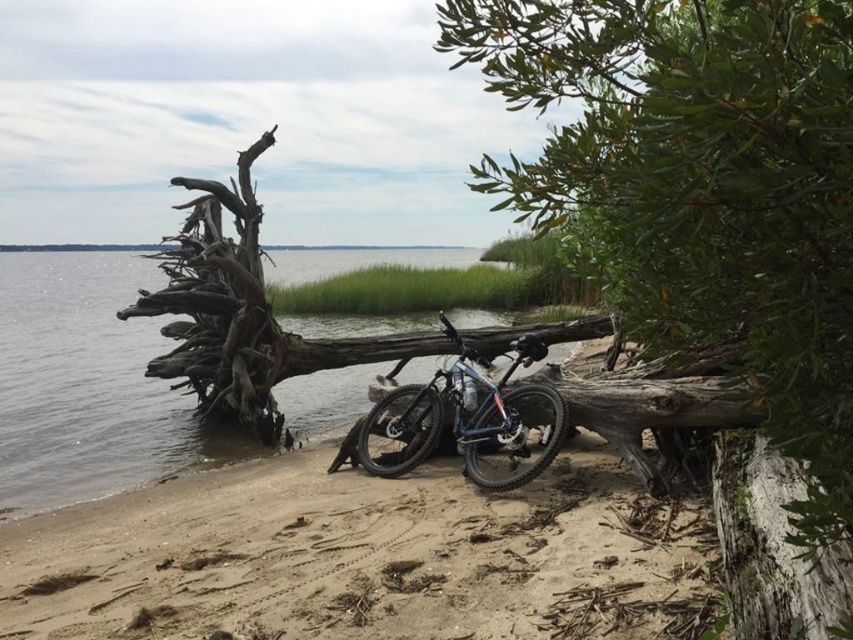
You are standing on the sandy beach at lower left and want to reach the shiny metallic bicycle at center. Which direction should you move to get there?

You should move to the right since the shiny metallic bicycle at center is positioned to the right of the sandy beach at lower left.

You are planning to set up a small tent in this lakeside area. Which location between the green leafy tree at center and the sandy beach at lower left would provide more space for the tent? Please explain your reasoning based on the scene description.

The sandy beach at lower left provides more space for the tent because the green leafy tree at center is narrower in width compared to the sandy beach at lower left.